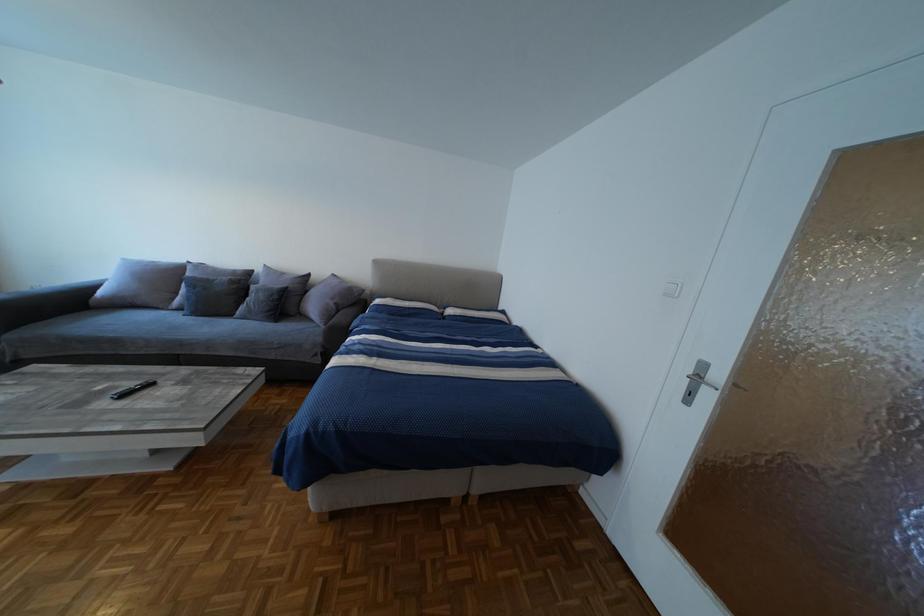
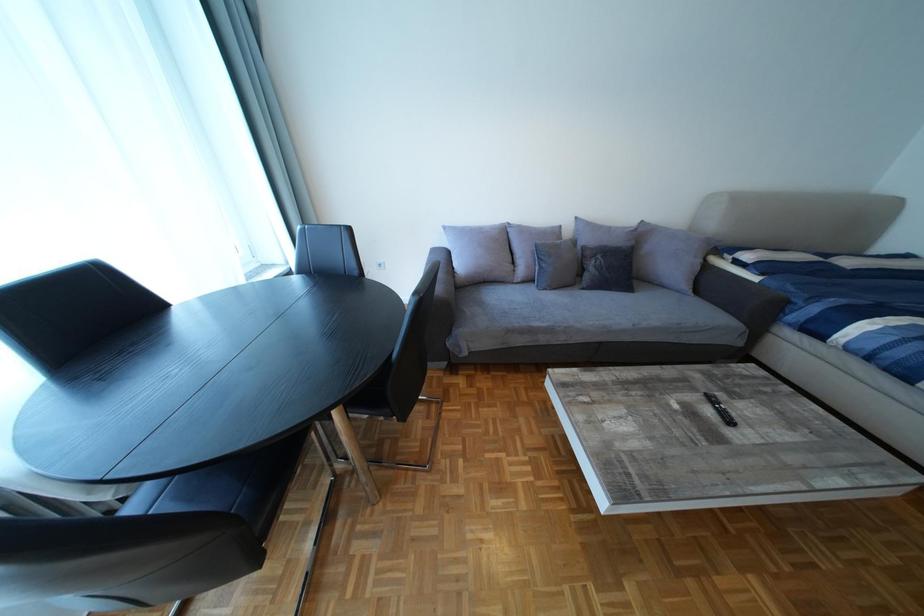
Question: Which direction would the cameraman need to move to produce the second image? Reply with the corresponding letter.

Choices:
 (A) Left
 (B) Right
 (C) Forward
 (D) Backward

Answer: (A)